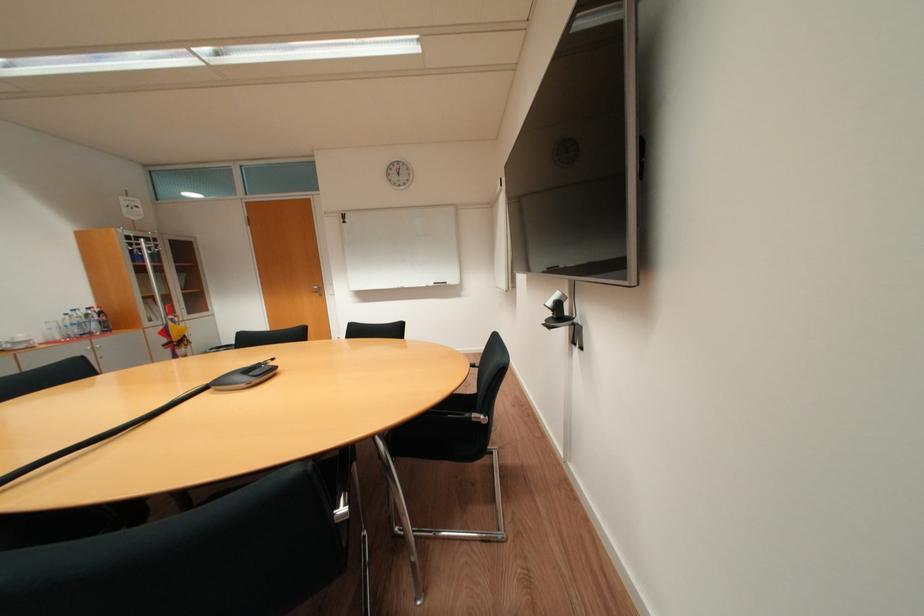
Where is `metal door handle`? metal door handle is located at coordinates (315, 289).